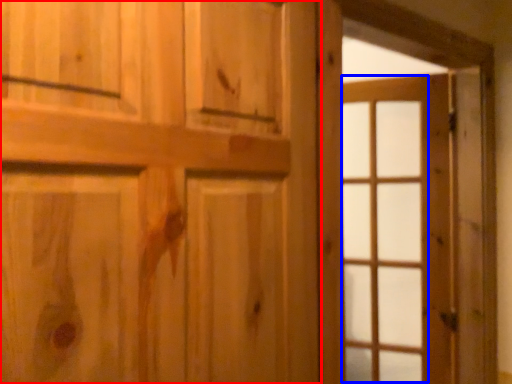
Question: Which point is further to the camera, door (highlighted by a red box) or glass door (highlighted by a blue box)?

Choices:
 (A) door
 (B) glass door

Answer: (B)